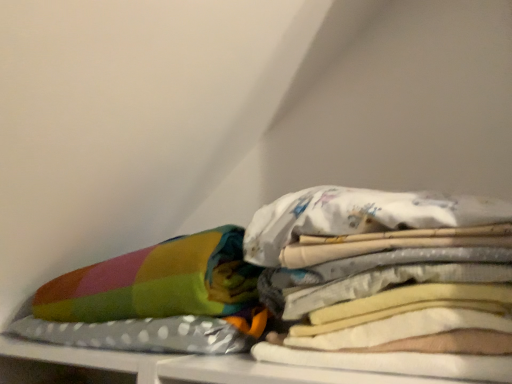
Identify the location of multicolored fabric pillow at left. (157, 282).

What do you see at coordinates (157, 282) in the screenshot?
I see `multicolored fabric pillow at left` at bounding box center [157, 282].

You are a GUI agent. You are given a task and a screenshot of the screen. Output one action in this format:
    pyautogui.click(x=<x>, y=<y>)
    Task: Click on the white fabric at center
    This screenshot has height=384, width=512.
    Given the screenshot: What is the action you would take?
    pyautogui.click(x=364, y=214)

What do you see at coordinates (364, 214) in the screenshot?
I see `white fabric at center` at bounding box center [364, 214].

Consider the image. Measure the distance between point (389,332) and camera.

Point (389,332) and camera are 22.05 inches apart from each other.

Where is `multicolored fabric pillow at left`? Image resolution: width=512 pixels, height=384 pixels. multicolored fabric pillow at left is located at coordinates (157, 282).

Which is more to the right, multicolored fabric pillow at left or white fabric at center?

From the viewer's perspective, white fabric at center appears more on the right side.

Is multicolored fabric pillow at left positioned behind white fabric at center?

Yes, it is.

Which point is more forward, [90,272] or [443,286]?

The point [443,286] is more forward.

From the image's perspective, relative to white fabric at center, is multicolored fabric pillow at left above or below?

From the image's perspective, multicolored fabric pillow at left appears below white fabric at center.

From a real-world perspective, between multicolored fabric pillow at left and white fabric at center, who is vertically higher?

white fabric at center.

In terms of width, does multicolored fabric pillow at left look wider or thinner when compared to white fabric at center?

In the image, multicolored fabric pillow at left appears to be wider than white fabric at center.

Between multicolored fabric pillow at left and white fabric at center, which one has less height?

white fabric at center is shorter.

Looking at the image, does multicolored fabric pillow at left seem bigger or smaller compared to white fabric at center?

Considering their sizes, multicolored fabric pillow at left takes up more space than white fabric at center.

Do you think multicolored fabric pillow at left is within white fabric at center, or outside of it?

multicolored fabric pillow at left is spatially situated outside white fabric at center.

Is multicolored fabric pillow at left positioned far away from white fabric at center?

No, multicolored fabric pillow at left is not far away from white fabric at center.

Is multicolored fabric pillow at left facing away from white fabric at center?

That's not correct — multicolored fabric pillow at left is not looking away from white fabric at center.

How many degrees apart are the facing directions of multicolored fabric pillow at left and white fabric at center?

The angular difference between multicolored fabric pillow at left and white fabric at center is 0.00385 degrees.

In the image, there is a white fabric at center. Where is `material below it (from a real-world perspective)`? This screenshot has width=512, height=384. material below it (from a real-world perspective) is located at coordinates (157, 282).

Which object is positioned more to the right, white fabric at center or multicolored fabric pillow at left?

A: white fabric at center.

Between white fabric at center and multicolored fabric pillow at left, which one is positioned behind?

multicolored fabric pillow at left.

Considering the positions of points (84, 320) and (210, 310), is point (84, 320) closer to camera compared to point (210, 310)?

No, (84, 320) is behind (210, 310).

From the image's perspective, does white fabric at center appear higher than multicolored fabric pillow at left?

Yes, from the image's perspective, white fabric at center is above multicolored fabric pillow at left.

From a real-world perspective, is white fabric at center under multicolored fabric pillow at left?

Incorrect, from a real-world perspective, white fabric at center is higher than multicolored fabric pillow at left.

Between white fabric at center and multicolored fabric pillow at left, which one has smaller width?

white fabric at center is thinner.

Is white fabric at center shorter than multicolored fabric pillow at left?

Correct, white fabric at center is not as tall as multicolored fabric pillow at left.

Considering the relative sizes of white fabric at center and multicolored fabric pillow at left in the image provided, is white fabric at center bigger than multicolored fabric pillow at left?

No.

Is white fabric at center situated inside multicolored fabric pillow at left or outside?

white fabric at center exists outside the volume of multicolored fabric pillow at left.

Is the surface of white fabric at center in direct contact with multicolored fabric pillow at left?

No, white fabric at center is not making contact with multicolored fabric pillow at left.

Is white fabric at center turned away from multicolored fabric pillow at left?

white fabric at center is not turned away from multicolored fabric pillow at left.

What's the angular difference between white fabric at center and multicolored fabric pillow at left's facing directions?

There is a 0.00385-degree angle between the facing directions of white fabric at center and multicolored fabric pillow at left.

How much distance is there between white fabric at center and multicolored fabric pillow at left?

A distance of 5.28 inches exists between white fabric at center and multicolored fabric pillow at left.

This screenshot has height=384, width=512. In order to click on furniture that appears above the multicolored fabric pillow at left (from a real-world perspective) in this screenshot , I will do `click(364, 214)`.

The width and height of the screenshot is (512, 384). In order to click on furniture that is above the multicolored fabric pillow at left (from a real-world perspective) in this screenshot , I will do `click(364, 214)`.

You are a GUI agent. You are given a task and a screenshot of the screen. Output one action in this format:
    pyautogui.click(x=<x>, y=<y>)
    Task: Click on the material that appears below the white fabric at center (from the image's perspective)
    The width and height of the screenshot is (512, 384).
    Given the screenshot: What is the action you would take?
    pyautogui.click(x=157, y=282)